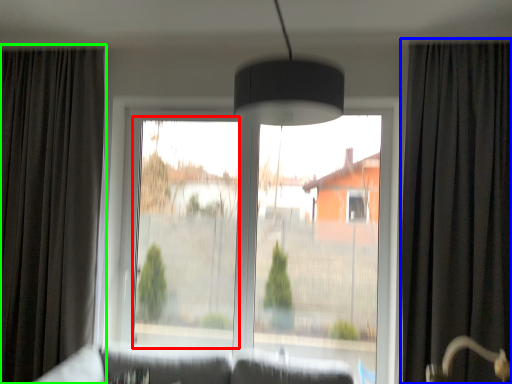
Question: Which object is the closest to the window screen (highlighted by a red box)? Choose among these: curtain (highlighted by a blue box) or curtain (highlighted by a green box).

Choices:
 (A) curtain
 (B) curtain

Answer: (B)